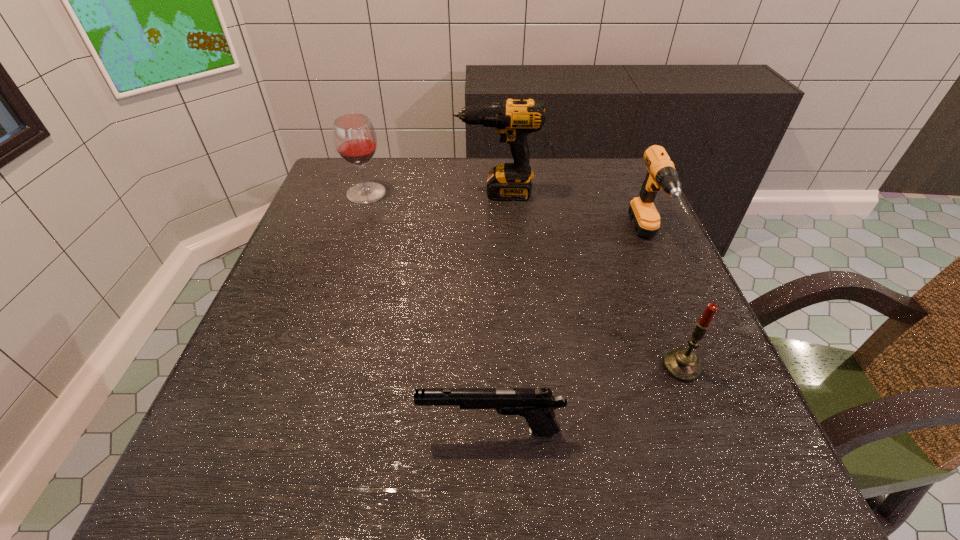
You are a GUI agent. You are given a task and a screenshot of the screen. Output one action in this format:
    pyautogui.click(x=<x>, y=<y>)
    Task: Click on the free space located at the tip of the left drill
    The height and width of the screenshot is (540, 960).
    Given the screenshot: What is the action you would take?
    pyautogui.click(x=341, y=193)

This screenshot has width=960, height=540. Identify the location of free space located 0.350m at the tip of the left drill. (321, 193).

The image size is (960, 540). I want to click on free space located 0.070m on the front of the wineglass, so click(357, 221).

I want to click on blank space located at the tip of the nearer drill, so click(673, 298).

In order to click on vacant space located 0.210m on the back of the fourth farthest object in this screenshot , I will do `click(644, 271)`.

I want to click on vacant space positioned at the aiming end of the shortest object, so click(316, 430).

This screenshot has height=540, width=960. In order to click on vacant space situated 0.150m at the aiming end of the shortest object in this screenshot , I will do `click(323, 430)`.

Where is `free space located 0.280m at the aiming end of the shortest object`? The width and height of the screenshot is (960, 540). free space located 0.280m at the aiming end of the shortest object is located at coordinates (237, 430).

The image size is (960, 540). I want to click on drill situated at the far edge, so click(x=513, y=119).

Find the location of a particular element. This screenshot has height=540, width=960. wineglass present at the far edge is located at coordinates (355, 140).